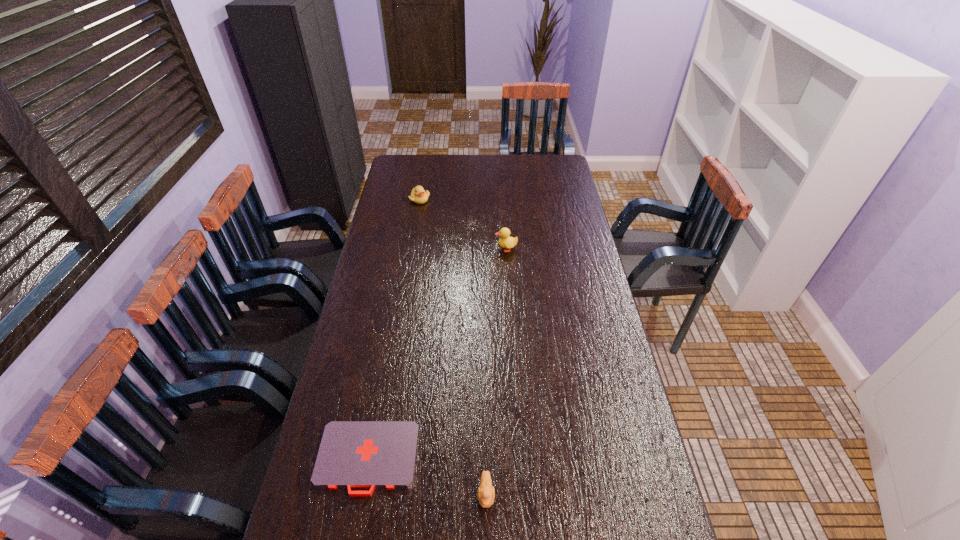
I want to click on free space located on the front-facing side of the farthest duckling, so click(x=416, y=225).

I want to click on vacant region located 0.080m on handle side the first-aid kit, so click(x=354, y=531).

Identify the location of duckling that is at the left edge. (418, 195).

I want to click on the first-aid kit at the left edge, so click(372, 454).

Image resolution: width=960 pixels, height=540 pixels. Identify the location of vacant space at the far edge of the desktop. (452, 155).

Where is `free space at the left edge`? This screenshot has height=540, width=960. free space at the left edge is located at coordinates (369, 255).

Where is `vacant region at the right edge of the desktop`? vacant region at the right edge of the desktop is located at coordinates (544, 181).

At what (x,y) coordinates should I click in order to perform the action: click on free space at the far right corner. Please return your answer as a coordinate pair (x, y). The height and width of the screenshot is (540, 960). Looking at the image, I should click on (549, 164).

Image resolution: width=960 pixels, height=540 pixels. Find the location of `free space between the shortest object and the second duckling from right to left`. free space between the shortest object and the second duckling from right to left is located at coordinates (427, 476).

Locate an element on the screen. The image size is (960, 540). unoccupied area between the second farthest duckling and the first-aid kit is located at coordinates (437, 354).